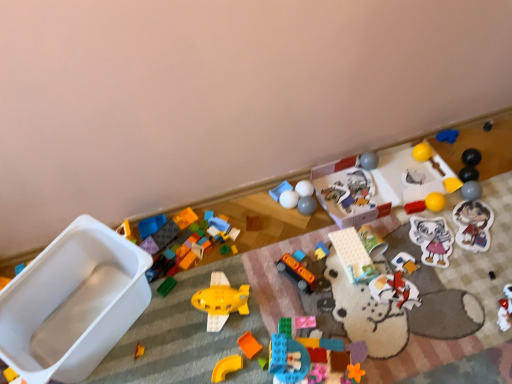
Describe the element at coordinates (304, 188) in the screenshot. The width and height of the screenshot is (512, 384). I see `white matte ball at center, placed as the 13th toy when sorted from right to left` at that location.

In order to click on orange plastic block at lower left, acting as the 23th toy starting from the right in this screenshot , I will do `click(139, 351)`.

The image size is (512, 384). Identify the location of matte gray ball at center, which is counted as the twelfth toy, starting from the right. (307, 205).

At what (x,y) coordinates should I click in order to perform the action: click on translucent plastic blocks at center, arranged as the second toy when viewed from the left. Please return your answer as a coordinate pair (x, y). The image size is (512, 384). Looking at the image, I should click on (151, 225).

From a real-world perspective, which toy is the 19th one underneath the translucent plastic toy airplane at center, the sixteenth toy from the left? Please provide its 2D coordinates.

[(253, 223)]

Based on the photo, considering the relative sizes of matte plastic toy at center, acting as the 7th toy starting from the left, and translucent plastic toy airplane at center, arranged as the tenth toy when viewed from the right, in the image provided, is matte plastic toy at center, acting as the 7th toy starting from the left, wider than translucent plastic toy airplane at center, arranged as the tenth toy when viewed from the right,?

In fact, matte plastic toy at center, acting as the 7th toy starting from the left, might be narrower than translucent plastic toy airplane at center, arranged as the tenth toy when viewed from the right.

Is matte plastic toy at center, acting as the 7th toy starting from the left, positioned far away from translucent plastic toy airplane at center, the sixteenth toy from the left?

Actually, matte plastic toy at center, acting as the 7th toy starting from the left, and translucent plastic toy airplane at center, the sixteenth toy from the left, are a little close together.

Is matte plastic toy at center, the nineteenth toy when ordered from right to left, facing towards translucent plastic toy airplane at center, the sixteenth toy from the left?

No.

Consider the image. Between white plastic container at left, which is the 1th toy in left-to-right order, and orange matte bus at center, the sixteenth toy in the right-to-left sequence, which one appears on the left side from the viewer's perspective?

white plastic container at left, which is the 1th toy in left-to-right order.

Does white plastic container at left, which is the 1th toy in left-to-right order, turn towards orange matte bus at center, the tenth toy when ordered from left to right?

No, white plastic container at left, which is the 1th toy in left-to-right order, is not aimed at orange matte bus at center, the tenth toy when ordered from left to right.

From the image's perspective, is white plastic container at left, arranged as the 25th toy when viewed from the right, below orange matte bus at center, the tenth toy when ordered from left to right?

Yes.

Between white plastic container at left, arranged as the 25th toy when viewed from the right, and orange matte bus at center, the tenth toy when ordered from left to right, which one has larger width?

white plastic container at left, arranged as the 25th toy when viewed from the right.

Identify the location of toy that is the 2nd one when counting upward from the translucent plastic blocks at center, which is the 24th toy from right to left (from the image's perspective). This screenshot has height=384, width=512. (253, 223).

From the image's perspective, which object appears higher, translucent plastic blocks at center, which is the 24th toy from right to left, or matte plastic toy at center, the nineteenth toy when ordered from right to left?

matte plastic toy at center, the nineteenth toy when ordered from right to left, is shown above in the image.

Would you say translucent plastic blocks at center, arranged as the second toy when viewed from the left, is inside or outside matte plastic toy at center, acting as the 7th toy starting from the left?

translucent plastic blocks at center, arranged as the second toy when viewed from the left, is not enclosed by matte plastic toy at center, acting as the 7th toy starting from the left.

Is the position of white matte figure at center, the nineteenth toy viewed from the left, less distant than that of yellow rubber ball at upper right, the 21th toy in the left-to-right sequence?

Yes, the depth of white matte figure at center, the nineteenth toy viewed from the left, is less than that of yellow rubber ball at upper right, the 21th toy in the left-to-right sequence.

How far apart are white matte figure at center, the nineteenth toy viewed from the left, and yellow rubber ball at upper right, which is counted as the 5th toy, starting from the right?

white matte figure at center, the nineteenth toy viewed from the left, and yellow rubber ball at upper right, which is counted as the 5th toy, starting from the right, are 20.66 inches apart.

Is white matte figure at center, placed as the seventh toy when sorted from right to left, oriented away from yellow rubber ball at upper right, the 21th toy in the left-to-right sequence?

white matte figure at center, placed as the seventh toy when sorted from right to left, is not turned away from yellow rubber ball at upper right, the 21th toy in the left-to-right sequence.

Is white matte figure at center, the nineteenth toy viewed from the left, next to yellow rubber ball at upper right, which is counted as the 5th toy, starting from the right, and touching it?

white matte figure at center, the nineteenth toy viewed from the left, and yellow rubber ball at upper right, which is counted as the 5th toy, starting from the right, are clearly separated.

Considering the sizes of translucent plastic blocks at center, arranged as the second toy when viewed from the left, and green cardboard box at center, the eighth toy viewed from the right, in the image, is translucent plastic blocks at center, arranged as the second toy when viewed from the left, wider or thinner than green cardboard box at center, the eighth toy viewed from the right,?

translucent plastic blocks at center, arranged as the second toy when viewed from the left, is thinner than green cardboard box at center, the eighth toy viewed from the right.

Could you tell me if translucent plastic blocks at center, arranged as the second toy when viewed from the left, is turned towards green cardboard box at center, the eighth toy viewed from the right?

No, translucent plastic blocks at center, arranged as the second toy when viewed from the left, is not oriented towards green cardboard box at center, the eighth toy viewed from the right.

Which is behind, translucent plastic blocks at center, which is the 24th toy from right to left, or green cardboard box at center, placed as the eighteenth toy when sorted from left to right?

translucent plastic blocks at center, which is the 24th toy from right to left, is behind.

Considering the sizes of objects translucent plastic blocks at center, which is the 24th toy from right to left, and green cardboard box at center, placed as the eighteenth toy when sorted from left to right, in the image provided, who is bigger, translucent plastic blocks at center, which is the 24th toy from right to left, or green cardboard box at center, placed as the eighteenth toy when sorted from left to right,?

green cardboard box at center, placed as the eighteenth toy when sorted from left to right.

Is pink matte block at center, the twelfth toy viewed from the left, at the back of white matte figure at center, the nineteenth toy viewed from the left?

No, white matte figure at center, the nineteenth toy viewed from the left, is not facing away from pink matte block at center, the twelfth toy viewed from the left.

Considering the positions of objects white matte figure at center, placed as the seventh toy when sorted from right to left, and pink matte block at center, acting as the 14th toy starting from the right, in the image provided, who is behind, white matte figure at center, placed as the seventh toy when sorted from right to left, or pink matte block at center, acting as the 14th toy starting from the right,?

white matte figure at center, placed as the seventh toy when sorted from right to left, is more distant.

Are white matte figure at center, placed as the seventh toy when sorted from right to left, and pink matte block at center, the twelfth toy viewed from the left, beside each other?

No, white matte figure at center, placed as the seventh toy when sorted from right to left, is not touching pink matte block at center, the twelfth toy viewed from the left.

Can you tell me how much matte plastic blocks at center, the eighteenth toy in the right-to-left sequence, and white plastic toy at center, which ranks as the ninth toy in right-to-left order, differ in facing direction?

The facing directions of matte plastic blocks at center, the eighteenth toy in the right-to-left sequence, and white plastic toy at center, which ranks as the ninth toy in right-to-left order, are 17.7 degrees apart.

From the image's perspective, is matte plastic blocks at center, the eighteenth toy in the right-to-left sequence, below white plastic toy at center, which ranks as the ninth toy in right-to-left order?

Yes, from the image's perspective, matte plastic blocks at center, the eighteenth toy in the right-to-left sequence, is beneath white plastic toy at center, which ranks as the ninth toy in right-to-left order.

Considering the sizes of objects matte plastic blocks at center, the eighth toy positioned from the left, and white plastic toy at center, which is the seventeenth toy from left to right, in the image provided, who is shorter, matte plastic blocks at center, the eighth toy positioned from the left, or white plastic toy at center, which is the seventeenth toy from left to right,?

white plastic toy at center, which is the seventeenth toy from left to right, is shorter.

Which object is positioned more to the right, matte plastic blocks at center, the eighteenth toy in the right-to-left sequence, or white plastic toy at center, which ranks as the ninth toy in right-to-left order?

white plastic toy at center, which ranks as the ninth toy in right-to-left order, is more to the right.

You are a GUI agent. You are given a task and a screenshot of the screen. Output one action in this format:
    pyautogui.click(x=<x>, y=<y>)
    Task: Click on the 5th toy above when counting from the translucent plastic toy airplane at center, the sixteenth toy from the left (from the image's perspective)
    Image resolution: width=512 pixels, height=384 pixels.
    Given the screenshot: What is the action you would take?
    pyautogui.click(x=253, y=223)

From a real-world perspective, starting from the white plastic container at left, which is the 1th toy in left-to-right order, which toy is the 2nd one below it? Please provide its 2D coordinates.

[(296, 273)]

Estimate the real-world distances between objects in this image. Which object is further from yellow matte square at center-right, which is the 4th toy in right-to-left order, matte gray ball at center, which is counted as the twelfth toy, starting from the right, or matte plastic toy at center, acting as the 7th toy starting from the left?

Based on the image, matte plastic toy at center, acting as the 7th toy starting from the left, appears to be further to yellow matte square at center-right, which is the 4th toy in right-to-left order.

Which object lies nearer to the anchor point white plastic toy at center, which is the seventeenth toy from left to right, blue plastic toy at upper right, arranged as the 25th toy when viewed from the left, or matte gray ball at right, the 2th toy from the right?

matte gray ball at right, the 2th toy from the right, lies closer to white plastic toy at center, which is the seventeenth toy from left to right, than the other object.

Based on the photo, from the image, which object appears to be farther from yellow matte square at center-right, placed as the 22th toy when sorted from left to right, white plastic toy at center, which ranks as the ninth toy in right-to-left order, or orange matte block at center, acting as the sixth toy starting from the left?

orange matte block at center, acting as the sixth toy starting from the left.

Based on their spatial positions, is translucent plastic toy airplane at center, arranged as the tenth toy when viewed from the right, or matte plastic blocks at center, the eighth toy positioned from the left, closer to yellow rubber ball at upper right, the 21th toy in the left-to-right sequence?

translucent plastic toy airplane at center, arranged as the tenth toy when viewed from the right, lies closer to yellow rubber ball at upper right, the 21th toy in the left-to-right sequence, than the other object.

Which object lies nearer to the anchor point matte gray ball at center, which appears as the 14th toy when viewed from the left, blue plastic toy at upper right, arranged as the 25th toy when viewed from the left, or yellow rubber ball at upper right, which is counted as the 5th toy, starting from the right?

yellow rubber ball at upper right, which is counted as the 5th toy, starting from the right, is closer to matte gray ball at center, which appears as the 14th toy when viewed from the left.

From the image, which object appears to be farther from matte plastic blocks at center, the eighteenth toy in the right-to-left sequence, orange plastic block at lower left, acting as the 23th toy starting from the right, or rubber duck at center, positioned as the 15th toy in left-to-right order?

orange plastic block at lower left, acting as the 23th toy starting from the right, lies further to matte plastic blocks at center, the eighteenth toy in the right-to-left sequence, than the other object.

Which object lies nearer to the anchor point orange matte block at center, acting as the sixth toy starting from the left, yellow matte square at center-right, placed as the 22th toy when sorted from left to right, or matte gray ball at center, which appears as the 14th toy when viewed from the left?

matte gray ball at center, which appears as the 14th toy when viewed from the left, is closer to orange matte block at center, acting as the sixth toy starting from the left.

Based on their spatial positions, is translucent plastic toy airplane at center, arranged as the tenth toy when viewed from the right, or matte gray ball at center, which appears as the 14th toy when viewed from the left, further from matte plastic blocks at center, the eighth toy positioned from the left?

Among the two, translucent plastic toy airplane at center, arranged as the tenth toy when viewed from the right, is located further to matte plastic blocks at center, the eighth toy positioned from the left.

Identify the location of toy between orange plastic block at lower left, acting as the 23th toy starting from the right, and yellow plastic curve at center, which ranks as the 21th toy in right-to-left order. This screenshot has height=384, width=512. (221, 301).

At what (x,y) coordinates should I click in order to perform the action: click on toy between matte plastic toy at center, the nineteenth toy when ordered from right to left, and white matte balls at center, the ninth toy viewed from the left, from left to right. Please return your answer as a coordinate pair (x, y). This screenshot has width=512, height=384. Looking at the image, I should click on (280, 190).

You are a GUI agent. You are given a task and a screenshot of the screen. Output one action in this format:
    pyautogui.click(x=<x>, y=<y>)
    Task: Click on the toy between green cardboard box at center, placed as the eighteenth toy when sorted from left to right, and white glossy sticker at center-right, arranged as the twentieth toy when viewed from the left
    
    Given the screenshot: What is the action you would take?
    pyautogui.click(x=395, y=290)

The width and height of the screenshot is (512, 384). I want to click on toy between blue plastic toy at upper right, arranged as the 25th toy when viewed from the left, and yellow matte square at center-right, which is the 4th toy in right-to-left order, in the up-down direction, so click(x=422, y=152).